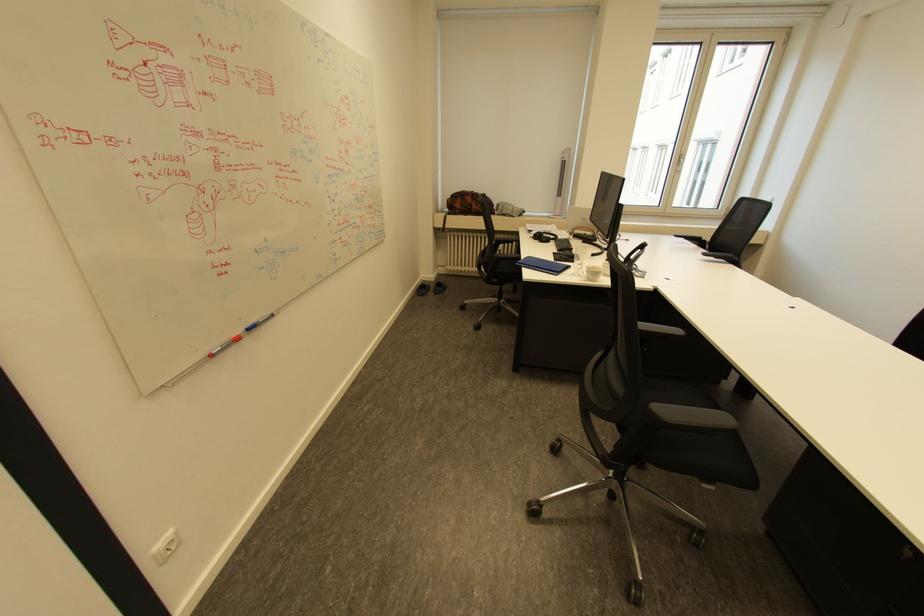
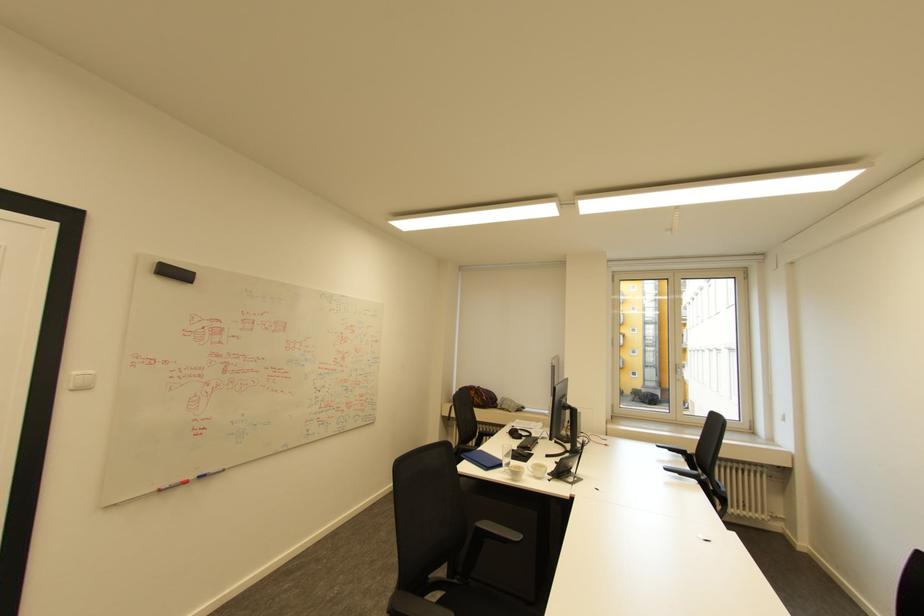
In the second image, find the point that corresponds to the point at 217,355 in the first image.

(165, 490)